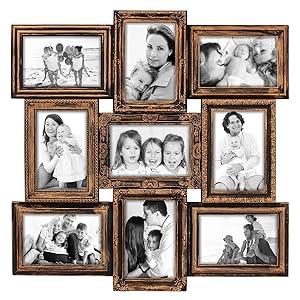
This screenshot has width=300, height=300. What are the coordinates of `framed pictures` in the screenshot? It's located at (59, 68), (146, 68), (228, 67), (174, 144), (65, 152), (66, 239), (149, 246), (218, 240), (231, 156).